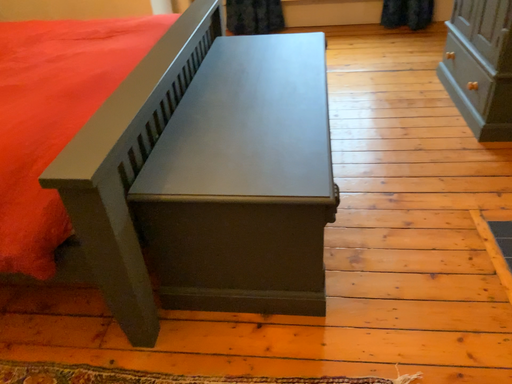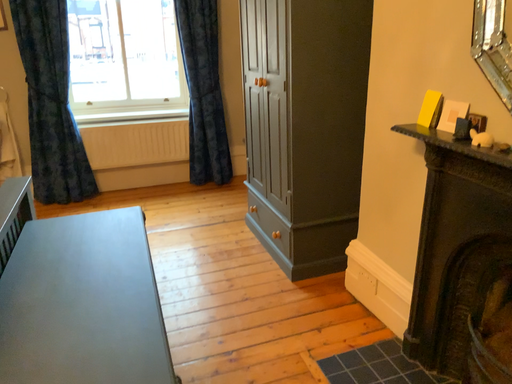
Question: How did the camera likely rotate when shooting the video?

Choices:
 (A) rotated downward
 (B) rotated upward

Answer: (B)